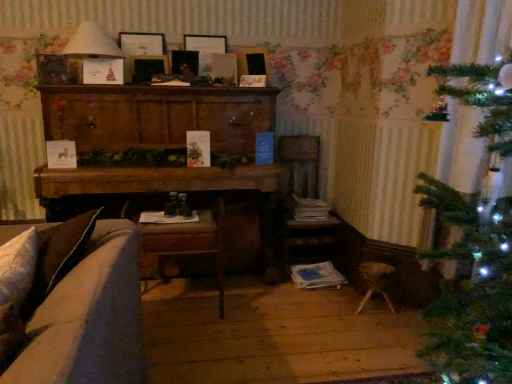
Where is `wooden picture frame at center, marked as the second picture frame in a left-to-right arrangement`? wooden picture frame at center, marked as the second picture frame in a left-to-right arrangement is located at coordinates (147, 67).

What do you see at coordinates (205, 49) in the screenshot? Image resolution: width=512 pixels, height=384 pixels. I see `wooden picture frame at upper center, marked as the 3th picture frame in a left-to-right arrangement` at bounding box center [205, 49].

Measure the distance between point (246, 49) and camera.

The distance of point (246, 49) from camera is 8.96 feet.

This screenshot has width=512, height=384. What do you see at coordinates (89, 318) in the screenshot? I see `velvet beige couch at lower left` at bounding box center [89, 318].

Where is `wooden cabinet at center`? This screenshot has width=512, height=384. wooden cabinet at center is located at coordinates (163, 154).

Consider the image. Measure the distance between point (82, 45) and camera.

They are 7.71 feet apart.

What is the approximate width of wooden armchair at center?

It is 17.50 inches.

I want to click on wooden picture frame at center, the 3th picture frame positioned from the right, so click(x=147, y=67).

Is matte white lampshade at upper left to the right of matte wooden picture frame at upper center, which is counted as the 1th picture frame, starting from the right, from the viewer's perspective?

No, matte white lampshade at upper left is not to the right of matte wooden picture frame at upper center, which is counted as the 1th picture frame, starting from the right.

How far apart are matte white lampshade at upper left and matte wooden picture frame at upper center, which appears as the fourth picture frame when viewed from the left?

They are 32.65 inches apart.

From the image's perspective, is matte white lampshade at upper left above or below matte wooden picture frame at upper center, which is counted as the 1th picture frame, starting from the right?

matte white lampshade at upper left is below matte wooden picture frame at upper center, which is counted as the 1th picture frame, starting from the right.

Who is shorter, matte white lampshade at upper left or matte wooden picture frame at upper center, which is counted as the 1th picture frame, starting from the right?

matte wooden picture frame at upper center, which is counted as the 1th picture frame, starting from the right.

Can you confirm if matte wooden picture frame at upper center, which is counted as the 1th picture frame, starting from the right, is positioned to the left of wooden picture frame at center, the 3th picture frame positioned from the right?

In fact, matte wooden picture frame at upper center, which is counted as the 1th picture frame, starting from the right, is to the right of wooden picture frame at center, the 3th picture frame positioned from the right.

From a real-world perspective, relative to wooden picture frame at center, marked as the second picture frame in a left-to-right arrangement, is matte wooden picture frame at upper center, which appears as the fourth picture frame when viewed from the left, vertically above or below?

matte wooden picture frame at upper center, which appears as the fourth picture frame when viewed from the left, is situated higher than wooden picture frame at center, marked as the second picture frame in a left-to-right arrangement, in the real world.

How different are the orientations of matte wooden picture frame at upper center, which appears as the fourth picture frame when viewed from the left, and wooden picture frame at center, marked as the second picture frame in a left-to-right arrangement, in degrees?

They differ by 36.4 degrees in their facing directions.

Where is `picture frame in front of the matte wooden picture frame at upper center, which appears as the fourth picture frame when viewed from the left`? The height and width of the screenshot is (384, 512). picture frame in front of the matte wooden picture frame at upper center, which appears as the fourth picture frame when viewed from the left is located at coordinates (147, 67).

Between wooden armchair at center and matte wooden picture frame at upper center, which is counted as the 1th picture frame, starting from the right, which one has smaller width?

matte wooden picture frame at upper center, which is counted as the 1th picture frame, starting from the right.

There is a wooden armchair at center. Find the location of `the 2nd picture frame above it (from the image's perspective)`. the 2nd picture frame above it (from the image's perspective) is located at coordinates [x=253, y=62].

Is wooden armchair at center not near matte wooden picture frame at upper center, which appears as the fourth picture frame when viewed from the left?

wooden armchair at center is actually quite close to matte wooden picture frame at upper center, which appears as the fourth picture frame when viewed from the left.

Considering the relative sizes of wooden armchair at center and matte wooden picture frame at upper center, which appears as the fourth picture frame when viewed from the left, in the image provided, is wooden armchair at center bigger than matte wooden picture frame at upper center, which appears as the fourth picture frame when viewed from the left,?

Yes, wooden armchair at center is bigger than matte wooden picture frame at upper center, which appears as the fourth picture frame when viewed from the left.

Considering the sizes of objects wooden picture frame at upper center, the second picture frame in the right-to-left sequence, and matte white lampshade at upper left in the image provided, who is taller, wooden picture frame at upper center, the second picture frame in the right-to-left sequence, or matte white lampshade at upper left?

With more height is matte white lampshade at upper left.

Is wooden picture frame at upper center, the second picture frame in the right-to-left sequence, oriented towards matte white lampshade at upper left?

No, wooden picture frame at upper center, the second picture frame in the right-to-left sequence, is not oriented towards matte white lampshade at upper left.

Between wooden picture frame at upper center, the second picture frame in the right-to-left sequence, and matte white lampshade at upper left, which one has smaller size?

wooden picture frame at upper center, the second picture frame in the right-to-left sequence.

Between wooden picture frame at upper center, the second picture frame in the right-to-left sequence, and matte white lampshade at upper left, which one appears on the right side from the viewer's perspective?

From the viewer's perspective, wooden picture frame at upper center, the second picture frame in the right-to-left sequence, appears more on the right side.

Is woodenchair at lower center turned away from wooden picture frame at center, marked as the second picture frame in a left-to-right arrangement?

No, woodenchair at lower center is not facing away from wooden picture frame at center, marked as the second picture frame in a left-to-right arrangement.

Is wooden picture frame at center, the 3th picture frame positioned from the right, a part of woodenchair at lower center?

Definitely not — wooden picture frame at center, the 3th picture frame positioned from the right, is not inside woodenchair at lower center.

Can you see woodenchair at lower center touching wooden picture frame at center, the 3th picture frame positioned from the right?

woodenchair at lower center and wooden picture frame at center, the 3th picture frame positioned from the right, are not in contact.

Locate an element on the screen. The image size is (512, 384). chair on the right side of wooden picture frame at center, the 3th picture frame positioned from the right is located at coordinates (185, 246).

Does point (132, 53) come farther from viewer compared to point (205, 61)?

No, (132, 53) is in front of (205, 61).

In terms of size, does matte wooden picture frame at upper center, the first picture frame viewed from the left, appear bigger or smaller than wooden picture frame at upper center, marked as the 3th picture frame in a left-to-right arrangement?

Considering their sizes, matte wooden picture frame at upper center, the first picture frame viewed from the left, takes up less space than wooden picture frame at upper center, marked as the 3th picture frame in a left-to-right arrangement.

From a real-world perspective, is matte wooden picture frame at upper center, the 4th picture frame in the right-to-left sequence, above or below wooden picture frame at upper center, the second picture frame in the right-to-left sequence?

matte wooden picture frame at upper center, the 4th picture frame in the right-to-left sequence, is situated higher than wooden picture frame at upper center, the second picture frame in the right-to-left sequence, in the real world.

Is woodenchair at lower center far away from matte wooden picture frame at upper center, which is counted as the 1th picture frame, starting from the right?

Yes, woodenchair at lower center and matte wooden picture frame at upper center, which is counted as the 1th picture frame, starting from the right, are quite far apart.

From the image's perspective, does woodenchair at lower center appear lower than matte wooden picture frame at upper center, which appears as the fourth picture frame when viewed from the left?

Yes.

From a real-world perspective, is woodenchair at lower center positioned above or below matte wooden picture frame at upper center, which is counted as the 1th picture frame, starting from the right?

In terms of real-world spatial position, woodenchair at lower center is below matte wooden picture frame at upper center, which is counted as the 1th picture frame, starting from the right.

The width and height of the screenshot is (512, 384). Identify the location of lamp that is below the matte wooden picture frame at upper center, which is counted as the 1th picture frame, starting from the right (from the image's perspective). (96, 54).

Where is `picture frame below the matte wooden picture frame at upper center, which is counted as the 1th picture frame, starting from the right (from a real-world perspective)`? picture frame below the matte wooden picture frame at upper center, which is counted as the 1th picture frame, starting from the right (from a real-world perspective) is located at coordinates (147, 67).

From the image, which object appears to be farther from wooden armchair at center, matte white lampshade at upper left or woodenchair at lower center?

Based on the image, matte white lampshade at upper left appears to be further to wooden armchair at center.

From the image, which object appears to be nearer to wooden armchair at center, matte wooden picture frame at upper center, the first picture frame viewed from the left, or velvet beige couch at lower left?

Based on the image, matte wooden picture frame at upper center, the first picture frame viewed from the left, appears to be nearer to wooden armchair at center.

Which object lies further to the anchor point wooden picture frame at upper center, the second picture frame in the right-to-left sequence, matte white lampshade at upper left or wooden cabinet at center?

wooden cabinet at center.

Estimate the real-world distances between objects in this image. Which object is closer to matte wooden picture frame at upper center, the 4th picture frame in the right-to-left sequence, velvet beige couch at lower left or wooden armchair at center?

wooden armchair at center is closer to matte wooden picture frame at upper center, the 4th picture frame in the right-to-left sequence.

From the image, which object appears to be nearer to wooden picture frame at center, marked as the second picture frame in a left-to-right arrangement, matte white lampshade at upper left or woodenchair at lower center?

Based on the image, matte white lampshade at upper left appears to be nearer to wooden picture frame at center, marked as the second picture frame in a left-to-right arrangement.

From the image, which object appears to be nearer to wooden armchair at center, velvet beige couch at lower left or wooden cabinet at center?

Based on the image, wooden cabinet at center appears to be nearer to wooden armchair at center.

Based on their spatial positions, is wooden armchair at center or velvet beige couch at lower left closer to matte wooden picture frame at upper center, the first picture frame viewed from the left?

Among the two, wooden armchair at center is located nearer to matte wooden picture frame at upper center, the first picture frame viewed from the left.

Looking at the image, which one is located further to wooden cabinet at center, matte wooden picture frame at upper center, which appears as the fourth picture frame when viewed from the left, or matte wooden picture frame at upper center, the 4th picture frame in the right-to-left sequence?

matte wooden picture frame at upper center, the 4th picture frame in the right-to-left sequence.

Where is `lamp located between velvet beige couch at lower left and matte wooden picture frame at upper center, the first picture frame viewed from the left, in the depth direction`? The height and width of the screenshot is (384, 512). lamp located between velvet beige couch at lower left and matte wooden picture frame at upper center, the first picture frame viewed from the left, in the depth direction is located at coordinates (96, 54).

You are a GUI agent. You are given a task and a screenshot of the screen. Output one action in this format:
    pyautogui.click(x=<x>, y=<y>)
    Task: Click on the armchair between matte wooden picture frame at upper center, the 4th picture frame in the right-to-left sequence, and woodenchair at lower center vertically
    The height and width of the screenshot is (384, 512).
    Given the screenshot: What is the action you would take?
    pyautogui.click(x=305, y=204)

Find the location of a particular element. The height and width of the screenshot is (384, 512). armchair between velvet beige couch at lower left and matte wooden picture frame at upper center, which is counted as the 1th picture frame, starting from the right, in the front-back direction is located at coordinates point(305,204).

Where is `entertainment center between wooden picture frame at center, marked as the second picture frame in a left-to-right arrangement, and wooden armchair at center`? The height and width of the screenshot is (384, 512). entertainment center between wooden picture frame at center, marked as the second picture frame in a left-to-right arrangement, and wooden armchair at center is located at coordinates (163, 154).